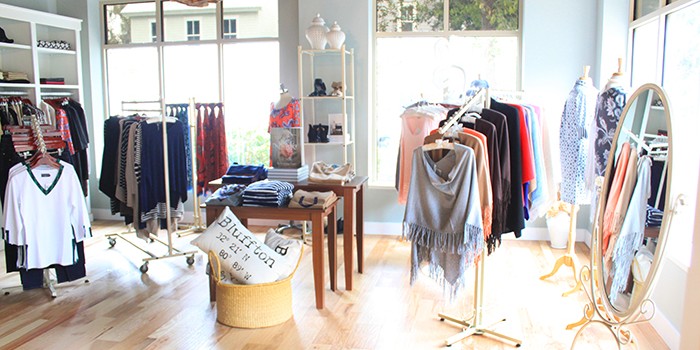
Identify the location of shelves inside. The width and height of the screenshot is (700, 350). (344, 109), (36, 69).